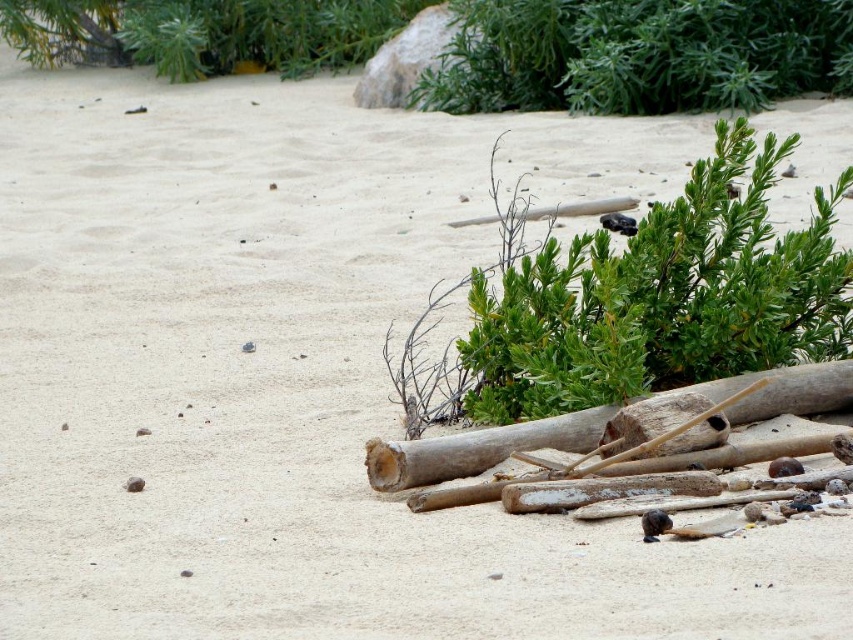
Question: Can you confirm if green leafy bush at upper center is smaller than white weathered log at lower right?

Choices:
 (A) no
 (B) yes

Answer: (A)

Question: Which object is farther from the camera taking this photo?

Choices:
 (A) green leafy bush at upper center
 (B) white weathered log at lower right

Answer: (A)

Question: Can you confirm if green leafy bush at upper center is bigger than white weathered log at lower right?

Choices:
 (A) yes
 (B) no

Answer: (A)

Question: Which point is closer to the camera taking this photo?

Choices:
 (A) (550, 35)
 (B) (460, 435)

Answer: (B)

Question: Does green leafy bush at upper center appear under white weathered log at lower right?

Choices:
 (A) no
 (B) yes

Answer: (A)

Question: Which point is farther to the camera?

Choices:
 (A) (480, 452)
 (B) (602, 67)

Answer: (B)